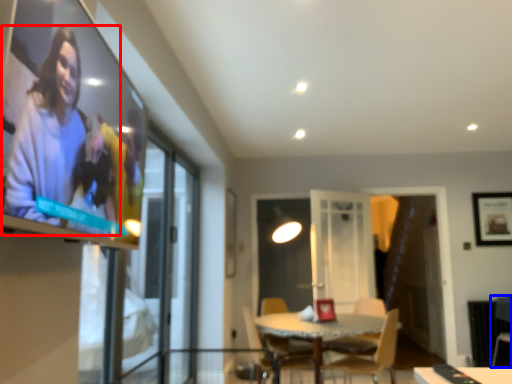
Question: Among these objects, which one is farthest to the camera, person (highlighted by a red box) or armchair (highlighted by a blue box)?

Choices:
 (A) person
 (B) armchair

Answer: (B)